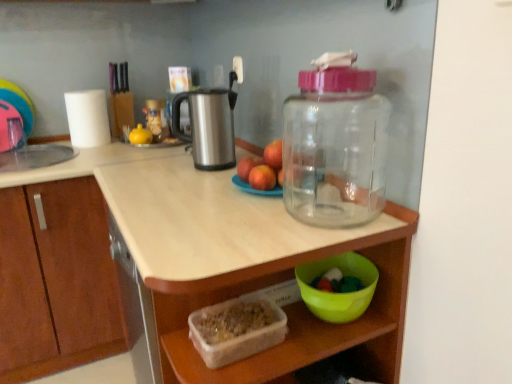
What are the coordinates of `free space in front of brushed metal electric kettle at upper center` in the screenshot? It's located at (195, 179).